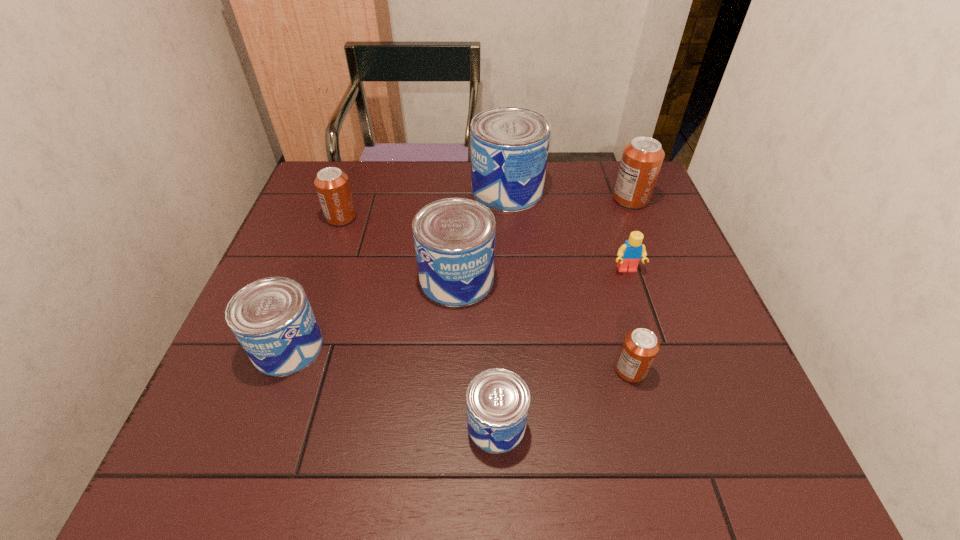
You are a GUI agent. You are given a task and a screenshot of the screen. Output one action in this format:
    pyautogui.click(x=<x>, y=<y>)
    Task: Click on the vacant space at the far edge of the desktop
    The width and height of the screenshot is (960, 540).
    Given the screenshot: What is the action you would take?
    pyautogui.click(x=415, y=183)

You are a GUI agent. You are given a task and a screenshot of the screen. Output one action in this format:
    pyautogui.click(x=<x>, y=<y>)
    Task: Click on the free space at the left edge of the desktop
    The image size is (960, 540).
    Given the screenshot: What is the action you would take?
    pyautogui.click(x=339, y=253)

What are the coordinates of `free space at the right edge of the desktop` in the screenshot? It's located at (666, 329).

Locate an element on the screen. The height and width of the screenshot is (540, 960). vacant space at the far left corner of the desktop is located at coordinates (313, 191).

The height and width of the screenshot is (540, 960). Identify the location of vacant region between the Lego and the biggest blue can. (567, 230).

Identify the location of vacant space in between the rightmost can and the yellow Lego. The height and width of the screenshot is (540, 960). (629, 234).

Image resolution: width=960 pixels, height=540 pixels. I want to click on free space between the sixth can from left to right and the second smallest blue can, so click(x=460, y=359).

At what (x,y) coordinates should I click in order to perform the action: click on free space between the Lego and the tallest can. Please return your answer as a coordinate pair (x, y). Looking at the image, I should click on (567, 230).

The image size is (960, 540). I want to click on free space between the tallest can and the nearest object, so click(x=502, y=307).

This screenshot has height=540, width=960. I want to click on vacant space that is in between the fourth farthest can and the nearest orange can, so click(543, 325).